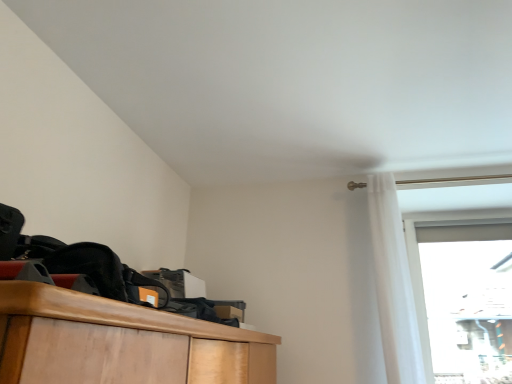
Question: Considering the positions of transparent glass door at upper right and white sheer curtain at upper right in the image, is transparent glass door at upper right bigger or smaller than white sheer curtain at upper right?

Choices:
 (A) small
 (B) big

Answer: (A)

Question: Does point (470, 342) appear closer or farther from the camera than point (377, 230)?

Choices:
 (A) farther
 (B) closer

Answer: (A)

Question: In terms of width, does transparent glass door at upper right look wider or thinner when compared to white sheer curtain at upper right?

Choices:
 (A) wide
 (B) thin

Answer: (B)

Question: In terms of width, does white sheer curtain at upper right look wider or thinner when compared to transparent glass door at upper right?

Choices:
 (A) wide
 (B) thin

Answer: (A)

Question: Considering their positions, is white sheer curtain at upper right located in front of or behind transparent glass door at upper right?

Choices:
 (A) behind
 (B) front

Answer: (B)

Question: Looking at the image, does white sheer curtain at upper right seem bigger or smaller compared to transparent glass door at upper right?

Choices:
 (A) small
 (B) big

Answer: (B)

Question: Is point (373, 182) closer or farther from the camera than point (426, 254)?

Choices:
 (A) closer
 (B) farther

Answer: (A)